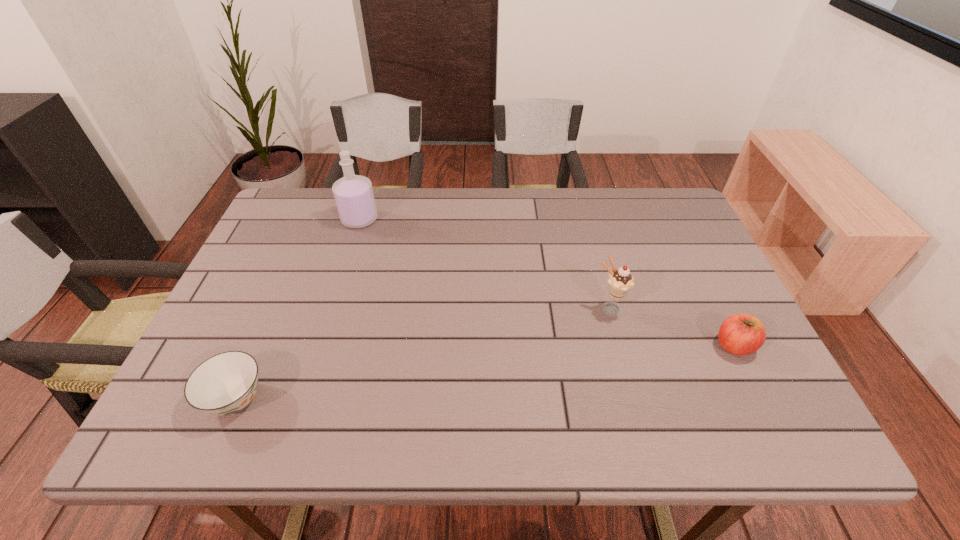
Where is `vacant area located on the left of the rightmost object`? vacant area located on the left of the rightmost object is located at coordinates (674, 346).

Image resolution: width=960 pixels, height=540 pixels. Identify the location of vacant area situated 0.290m on the right of the nearest object. (409, 399).

At what (x,y) coordinates should I click in order to perform the action: click on object at the far edge. Please return your answer as a coordinate pair (x, y). Looking at the image, I should click on click(353, 194).

This screenshot has height=540, width=960. Find the location of `object that is at the near edge`. object that is at the near edge is located at coordinates (224, 384).

I want to click on object that is at the left edge, so click(x=224, y=384).

Identify the location of object at the right edge. (740, 334).

The width and height of the screenshot is (960, 540). What are the coordinates of `object that is at the near left corner` in the screenshot? It's located at (224, 384).

Where is `free space at the far edge`? The width and height of the screenshot is (960, 540). free space at the far edge is located at coordinates (372, 225).

Find the location of a particular element. The width and height of the screenshot is (960, 540). blank area at the left edge is located at coordinates coord(277,286).

At what (x,y) coordinates should I click in order to perform the action: click on free space at the right edge of the desktop. Please return your answer as a coordinate pair (x, y). This screenshot has width=960, height=540. Looking at the image, I should click on (720, 402).